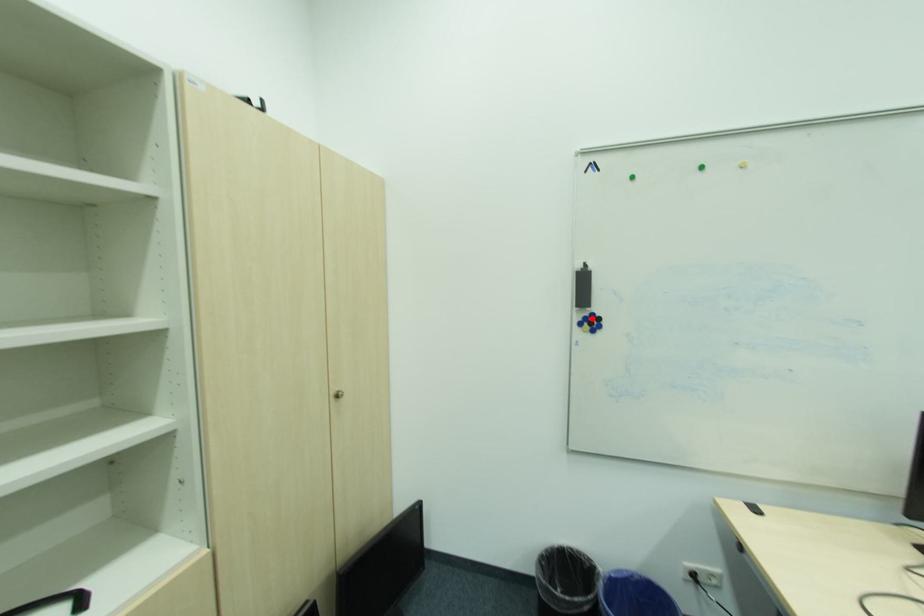
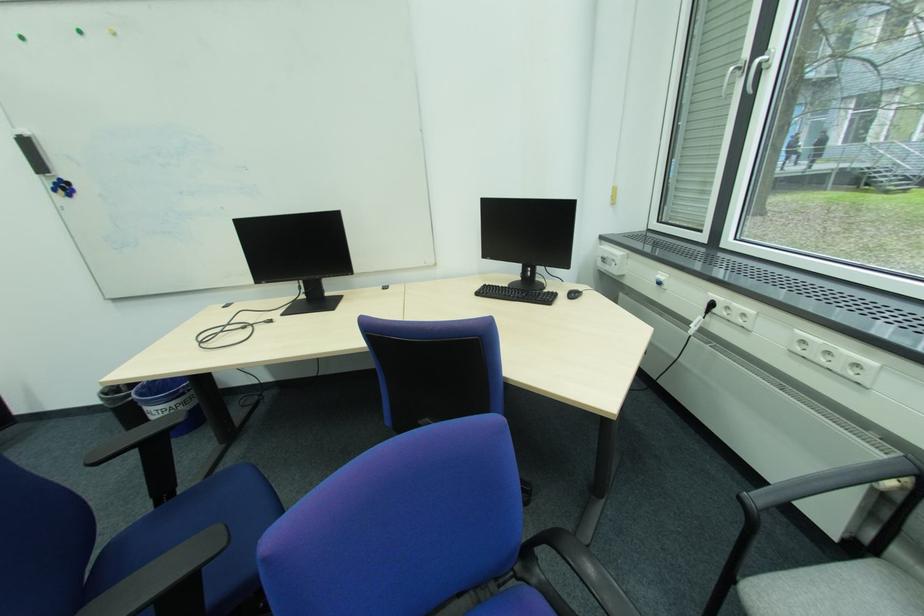
In the second image, find the point that corresponds to the highlighted location in the first image.

(62, 185)